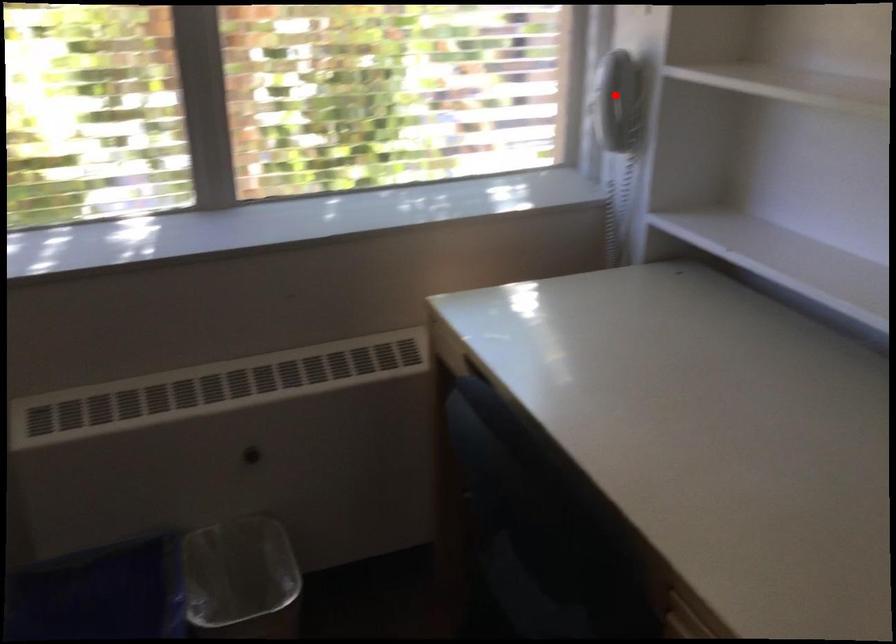
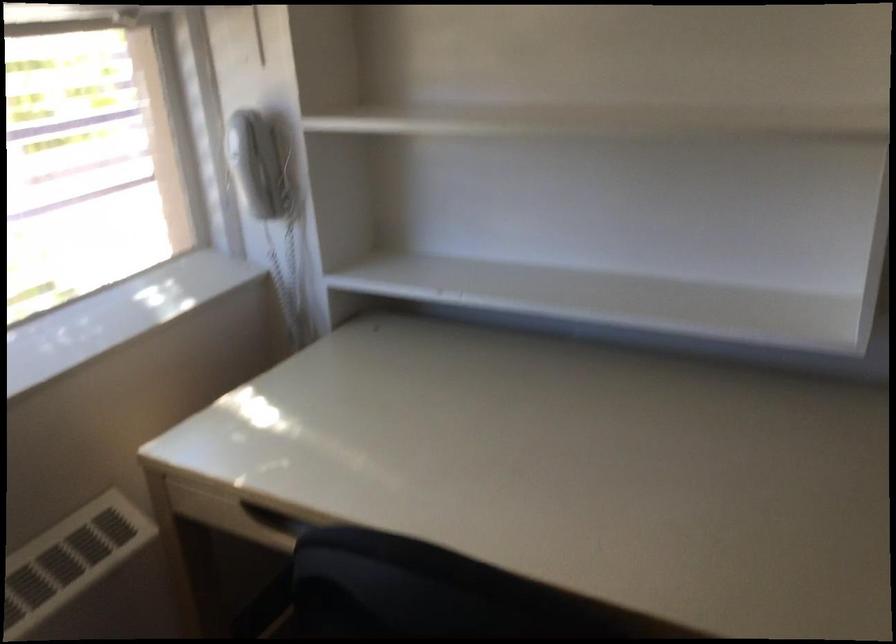
Question: A red point is marked in image1. In image2, is the corresponding 3D point closer to the camera or farther? Reply with the corresponding letter.

Choices:
 (A) The corresponding 3D point is closer.
 (B) The corresponding 3D point is farther.

Answer: (A)